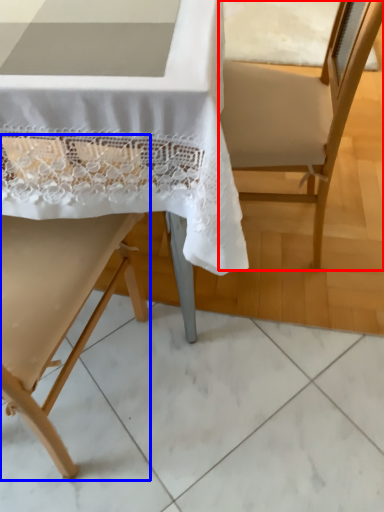
Question: Which point is further to the camera, armchair (highlighted by a red box) or chair (highlighted by a blue box)?

Choices:
 (A) armchair
 (B) chair

Answer: (A)